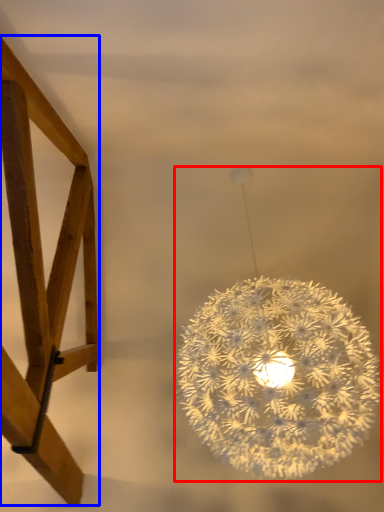
Question: Which point is closer to the camera, lamp (highlighted by a red box) or furniture (highlighted by a blue box)?

Choices:
 (A) lamp
 (B) furniture

Answer: (B)